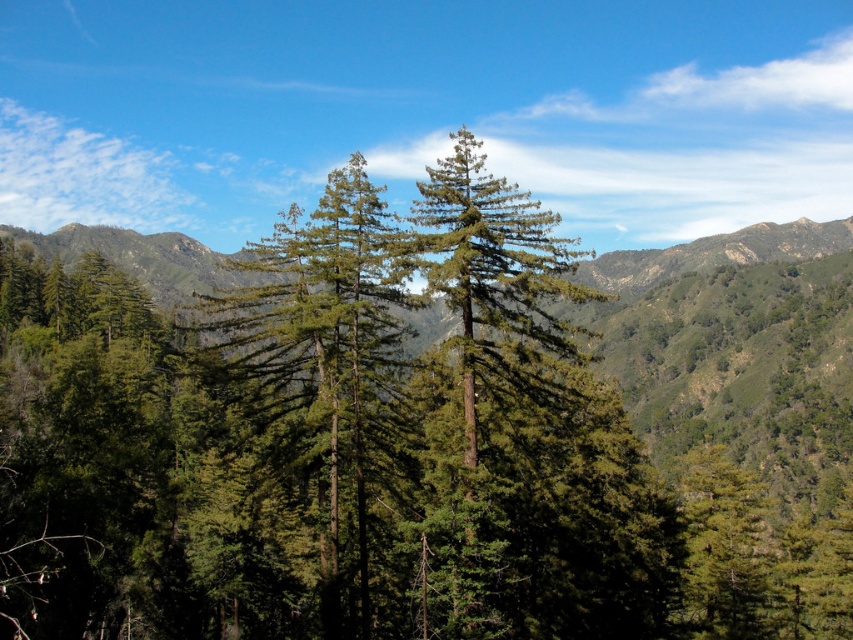
Does green matte tree at center appear on the left side of green needle-like at center?

Correct, you'll find green matte tree at center to the left of green needle-like at center.

In the scene shown: Between green matte tree at center and green needle-like at center, which one has less height?

Standing shorter between the two is green needle-like at center.

Is point (349, 292) closer to camera compared to point (474, 300)?

No.

The height and width of the screenshot is (640, 853). I want to click on green matte tree at center, so click(x=314, y=420).